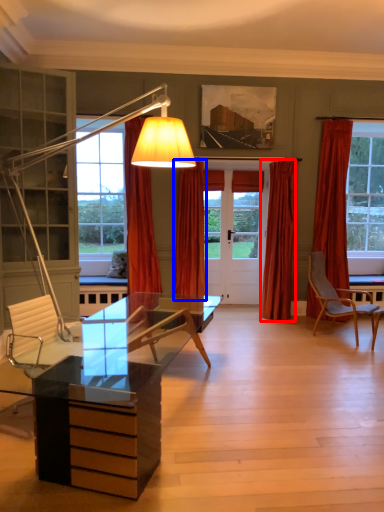
Question: Which of the following is the farthest to the observer, curtain (highlighted by a red box) or curtain (highlighted by a blue box)?

Choices:
 (A) curtain
 (B) curtain

Answer: (A)